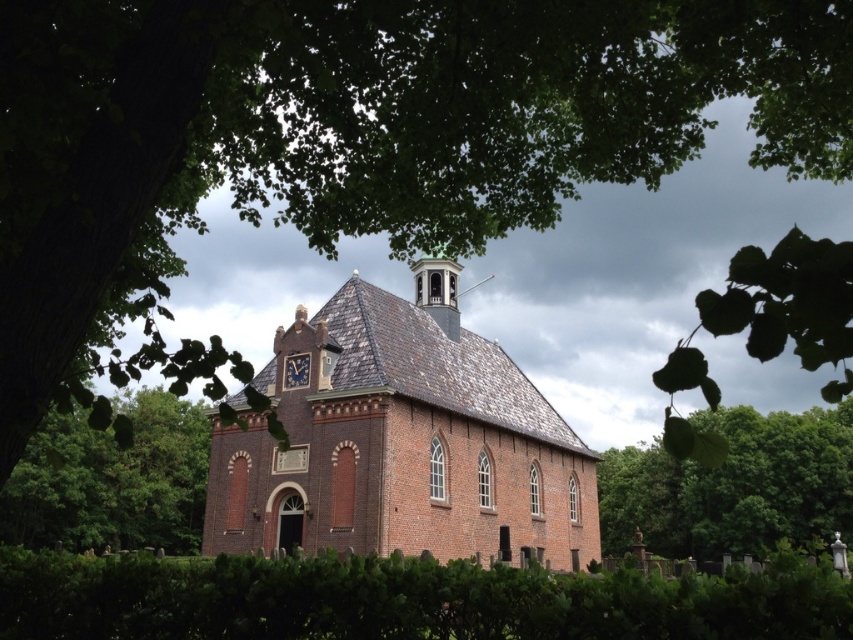
Does green leafy tree at right have a larger size compared to green leafy tree at lower left?

Incorrect, green leafy tree at right is not larger than green leafy tree at lower left.

The width and height of the screenshot is (853, 640). What do you see at coordinates (733, 486) in the screenshot?
I see `green leafy tree at right` at bounding box center [733, 486].

Where is `green leafy tree at right`? This screenshot has height=640, width=853. green leafy tree at right is located at coordinates (733, 486).

Is green leafy hedge at lower center behind dark brown wooden clock at center?

No, it is not.

Is point (627, 595) less distant than point (299, 353)?

Yes, it is.

Which is behind, point (486, 609) or point (288, 356)?

Positioned behind is point (288, 356).

I want to click on green leafy hedge at lower center, so click(x=403, y=600).

Based on the photo, measure the distance between point (271, 458) and camera.

The distance of point (271, 458) from camera is 73.39 meters.

Is brown brick church at center bigger than green leafy tree at lower left?

Actually, brown brick church at center might be smaller than green leafy tree at lower left.

Is point (339, 308) positioned before point (190, 499)?

Yes, it is in front of point (190, 499).

Locate an element on the screen. This screenshot has height=640, width=853. brown brick church at center is located at coordinates (402, 440).